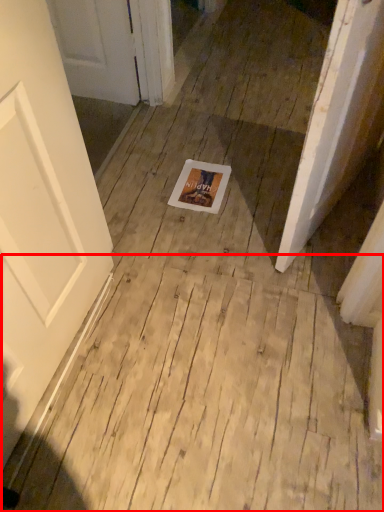
Question: From the image's perspective, where is plywood (annotated by the red box) located in relation to postcard in the image?

Choices:
 (A) below
 (B) above

Answer: (A)